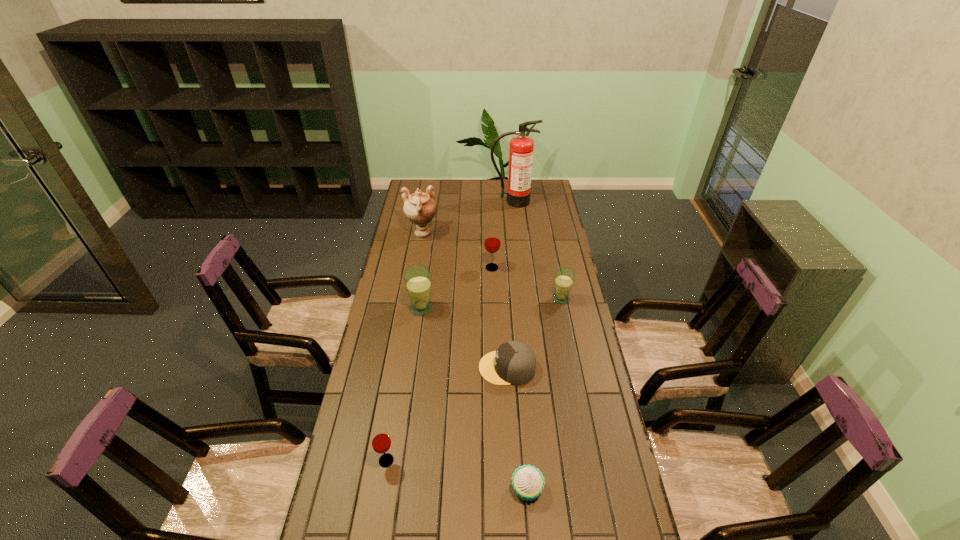
What are the coordinates of `vacant space positioned 0.140m on the right of the seventh farthest object` in the screenshot? It's located at (444, 461).

Locate an element on the screen. The image size is (960, 540). vacant position located on the back of the white cupcake is located at coordinates (522, 428).

Where is `vacant position located on the front-facing side of the gray cap`? This screenshot has width=960, height=540. vacant position located on the front-facing side of the gray cap is located at coordinates (384, 368).

At what (x,y) coordinates should I click in order to perform the action: click on free space located 0.390m on the front-facing side of the gray cap. Please return your answer as a coordinate pair (x, y). Looking at the image, I should click on (367, 368).

This screenshot has height=540, width=960. Identify the location of vacant space located on the front-facing side of the gray cap. (396, 368).

You are a GUI agent. You are given a task and a screenshot of the screen. Output one action in this format:
    pyautogui.click(x=<x>, y=<y>)
    Task: Click on the object present at the far edge
    This screenshot has height=540, width=960.
    Given the screenshot: What is the action you would take?
    pyautogui.click(x=521, y=148)

Find the location of a particular element. The width and height of the screenshot is (960, 540). urn located at the left edge is located at coordinates (420, 208).

Locate an element on the screen. The width and height of the screenshot is (960, 540). fire extinguisher positioned at the right edge is located at coordinates (521, 148).

At what (x,y) coordinates should I click in order to perform the action: click on glass that is at the right edge. Please return your answer as a coordinate pair (x, y). Looking at the image, I should click on (564, 277).

Identify the location of object positioned at the far right corner. This screenshot has width=960, height=540. (521, 148).